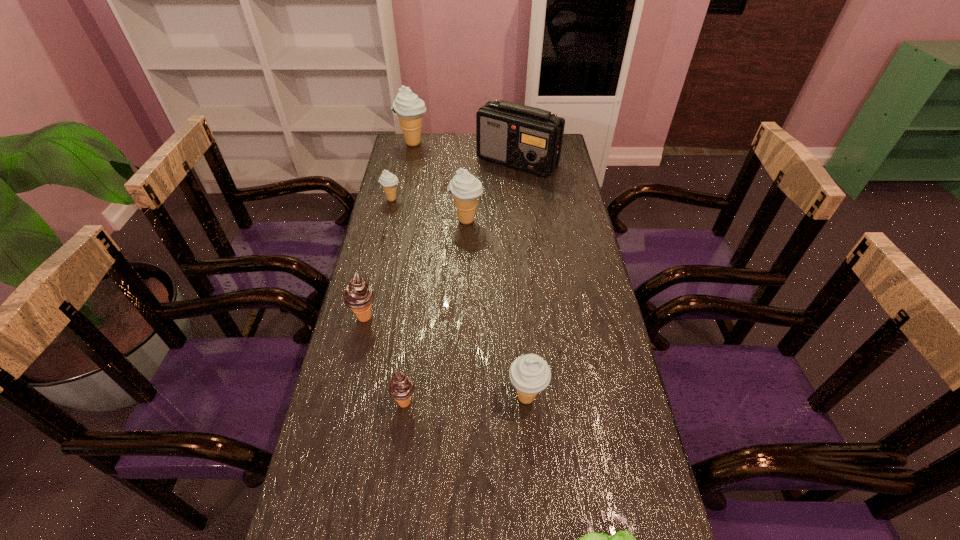
Where is `icecream that is at the far edge`? This screenshot has width=960, height=540. icecream that is at the far edge is located at coordinates (409, 108).

The width and height of the screenshot is (960, 540). I want to click on radio receiver situated at the far edge, so click(x=526, y=138).

Where is `object present at the right edge`? The image size is (960, 540). object present at the right edge is located at coordinates (526, 138).

I want to click on object situated at the far left corner, so click(409, 108).

Locate an element on the screen. This screenshot has height=540, width=960. object that is at the far right corner is located at coordinates (526, 138).

You are a GUI agent. You are given a task and a screenshot of the screen. Output one action in this format:
    pyautogui.click(x=<x>, y=<y>)
    Task: Click on the free space at the far edge
    
    Given the screenshot: What is the action you would take?
    pyautogui.click(x=443, y=136)

This screenshot has width=960, height=540. I want to click on free point at the left edge, so click(x=412, y=253).

Where is `vacant space at the right edge of the desktop`? Image resolution: width=960 pixels, height=540 pixels. vacant space at the right edge of the desktop is located at coordinates (588, 240).

The height and width of the screenshot is (540, 960). In order to click on vacant space at the far right corner in this screenshot , I will do `click(564, 143)`.

Where is `vacant space that's between the fourth icecream from left to right and the biggest beige icecream`? vacant space that's between the fourth icecream from left to right and the biggest beige icecream is located at coordinates (409, 273).